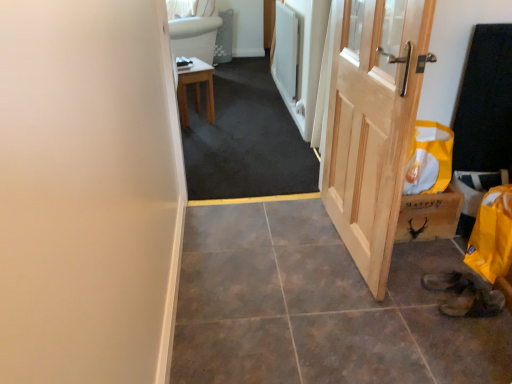
Question: Is dark gray carpet at center at the left side of wooden stool at center?

Choices:
 (A) no
 (B) yes

Answer: (A)

Question: Does dark gray carpet at center appear on the right side of wooden stool at center?

Choices:
 (A) no
 (B) yes

Answer: (B)

Question: From the image's perspective, is dark gray carpet at center under wooden stool at center?

Choices:
 (A) no
 (B) yes

Answer: (B)

Question: Does dark gray carpet at center have a smaller size compared to wooden stool at center?

Choices:
 (A) yes
 (B) no

Answer: (B)

Question: Can you confirm if dark gray carpet at center is wider than wooden stool at center?

Choices:
 (A) yes
 (B) no

Answer: (B)

Question: From the image's perspective, is dark gray carpet at center located above wooden stool at center?

Choices:
 (A) no
 (B) yes

Answer: (A)

Question: Is white fabric curtain at upper center oriented away from wooden stool at center?

Choices:
 (A) no
 (B) yes

Answer: (A)

Question: Considering the relative sizes of white fabric curtain at upper center and wooden stool at center in the image provided, is white fabric curtain at upper center taller than wooden stool at center?

Choices:
 (A) yes
 (B) no

Answer: (B)

Question: Considering the relative positions of white fabric curtain at upper center and wooden stool at center in the image provided, is white fabric curtain at upper center to the right of wooden stool at center from the viewer's perspective?

Choices:
 (A) yes
 (B) no

Answer: (B)

Question: Considering the relative positions of white fabric curtain at upper center and wooden stool at center in the image provided, is white fabric curtain at upper center behind wooden stool at center?

Choices:
 (A) yes
 (B) no

Answer: (A)

Question: Is white fabric curtain at upper center at the left side of wooden stool at center?

Choices:
 (A) yes
 (B) no

Answer: (A)

Question: From the image's perspective, would you say white fabric curtain at upper center is positioned over wooden stool at center?

Choices:
 (A) no
 (B) yes

Answer: (B)

Question: Is natural wood door at right facing towards wooden stool at center?

Choices:
 (A) yes
 (B) no

Answer: (B)